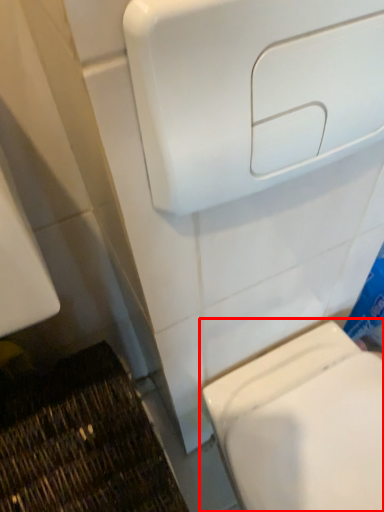
Question: Observing the image, what is the correct spatial positioning of toilet (annotated by the red box) in reference to hand dryer?

Choices:
 (A) right
 (B) left

Answer: (A)